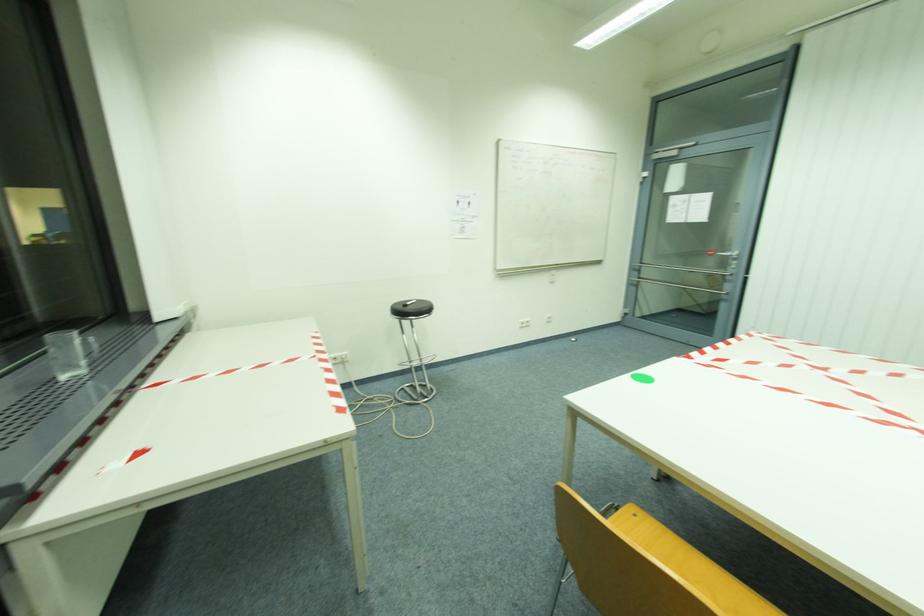
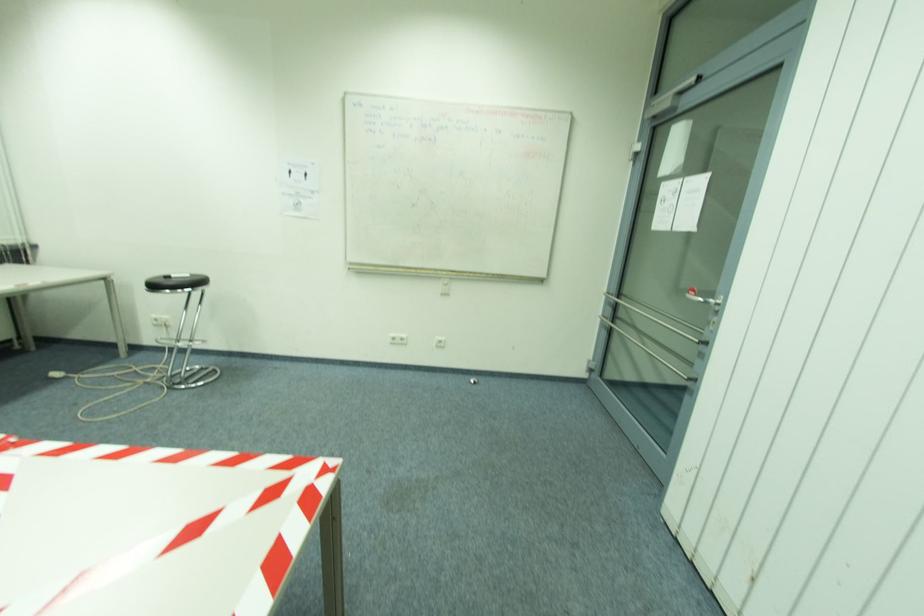
In a continuous first-person perspective shot, in which direction is the camera moving?

The movement direction of the cameraman is right, forward.